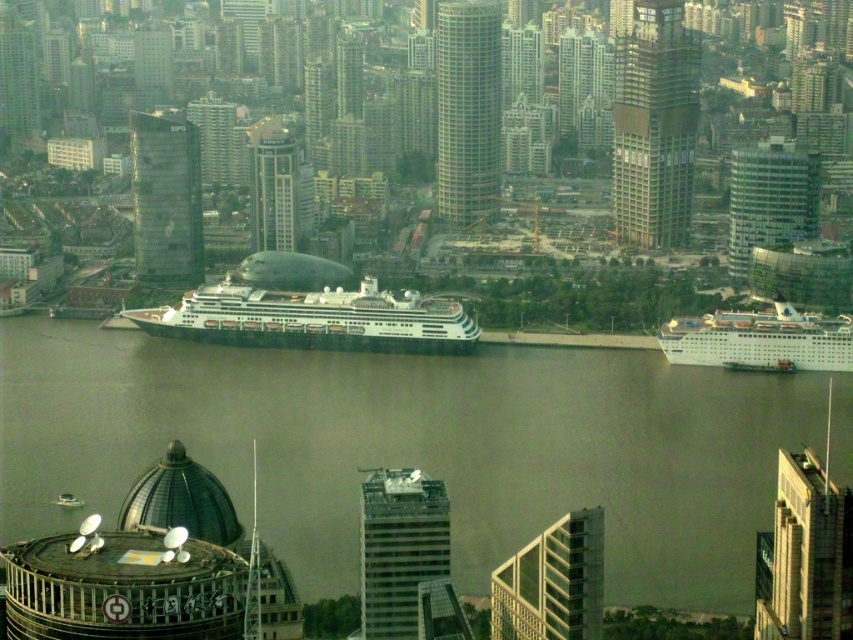
Looking at this image, you are a drone operator who needs to fly a drone from the metallic glass skyscraper at center to the white glossy boat at lower left. According to the scene, in which direction should you fly the drone to reach the boat?

The metallic glass skyscraper at center is to the right of the white glossy boat at lower left, so you should fly the drone to the left to reach the boat.